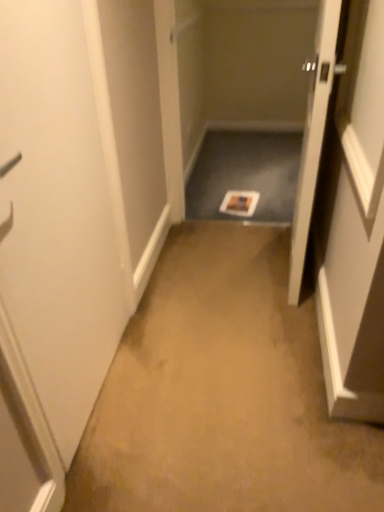
Question: Should I look upward or downward to see matte gray tray at center?

Choices:
 (A) up
 (B) down

Answer: (A)

Question: Can you confirm if white matte door at left, the first door in the left-to-right sequence, is shorter than matte gray tray at center?

Choices:
 (A) yes
 (B) no

Answer: (B)

Question: Is white matte door at left, the second door positioned from the right, closer to the viewer compared to matte gray tray at center?

Choices:
 (A) yes
 (B) no

Answer: (A)

Question: Is white matte door at left, the second door positioned from the right, to the left of matte gray tray at center from the viewer's perspective?

Choices:
 (A) no
 (B) yes

Answer: (B)

Question: Is the position of white matte door at left, the second door positioned from the right, more distant than that of matte gray tray at center?

Choices:
 (A) no
 (B) yes

Answer: (A)

Question: Could you tell me if white matte door at left, the second door positioned from the right, is facing matte gray tray at center?

Choices:
 (A) yes
 (B) no

Answer: (B)

Question: Is white matte door at left, the second door positioned from the right, wider than matte gray tray at center?

Choices:
 (A) no
 (B) yes

Answer: (A)

Question: Is the position of matte gray tray at center less distant than that of white matte door at left, the first door in the left-to-right sequence?

Choices:
 (A) no
 (B) yes

Answer: (A)

Question: Is matte gray tray at center oriented away from white matte door at left, the second door positioned from the right?

Choices:
 (A) no
 (B) yes

Answer: (A)

Question: Can you confirm if matte gray tray at center is taller than white matte door at left, the first door in the left-to-right sequence?

Choices:
 (A) no
 (B) yes

Answer: (A)

Question: Is matte gray tray at center next to white matte door at left, the second door positioned from the right?

Choices:
 (A) no
 (B) yes

Answer: (A)

Question: Does matte gray tray at center have a lesser height compared to white matte door at left, the first door in the left-to-right sequence?

Choices:
 (A) no
 (B) yes

Answer: (B)

Question: Is matte gray tray at center to the left of white matte door at left, the first door in the left-to-right sequence, from the viewer's perspective?

Choices:
 (A) no
 (B) yes

Answer: (A)

Question: Does wooden door at right, the second door from the left, turn towards matte gray tray at center?

Choices:
 (A) no
 (B) yes

Answer: (A)